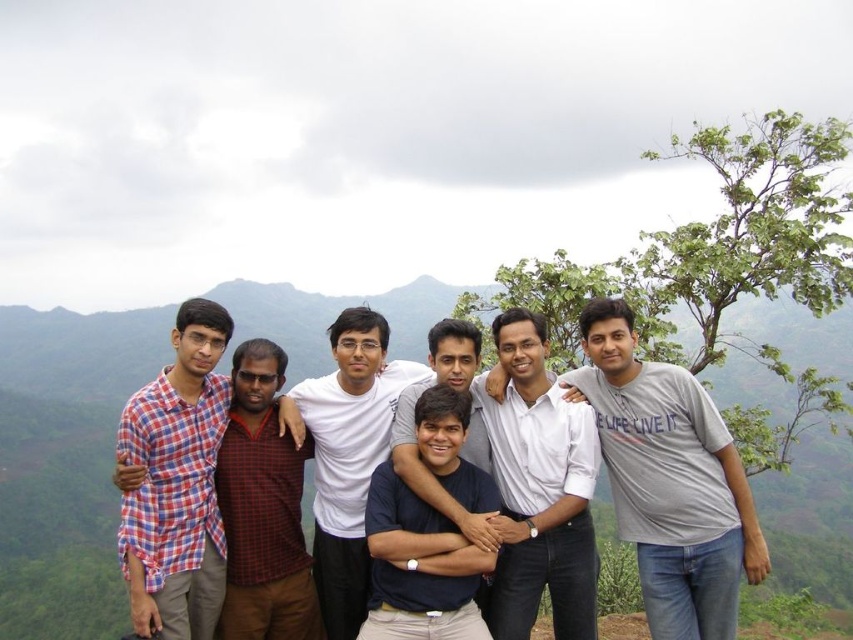
Does checkered fabric shirt at left have a greater height compared to white cotton shirt at center?

Incorrect, checkered fabric shirt at left's height is not larger of white cotton shirt at center's.

In the scene shown: Can you confirm if checkered fabric shirt at left is positioned to the right of white cotton shirt at center?

No, checkered fabric shirt at left is not to the right of white cotton shirt at center.

What do you see at coordinates (263, 508) in the screenshot? The height and width of the screenshot is (640, 853). I see `checkered fabric shirt at left` at bounding box center [263, 508].

I want to click on checkered fabric shirt at left, so click(x=263, y=508).

Is checkered fabric shirt at left further to the viewer compared to dark blue shirt at center?

No, it is in front of dark blue shirt at center.

Measure the distance between checkered fabric shirt at left and camera.

checkered fabric shirt at left and camera are 66.07 feet apart from each other.

Who is more forward, (258, 608) or (451, 452)?

Positioned in front is point (451, 452).

Identify the location of checkered fabric shirt at left. This screenshot has width=853, height=640. (263, 508).

Between white shirt at center and white cotton shirt at center, which one is positioned lower?

white cotton shirt at center is lower down.

Does point (505, 509) come in front of point (344, 614)?

Yes, it is.

Is point (576, 464) closer to camera compared to point (374, 433)?

That is True.

What are the coordinates of `white shirt at center` in the screenshot? It's located at (538, 490).